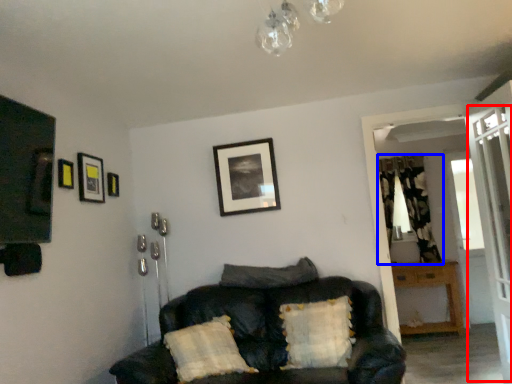
Question: Among these objects, which one is nearest to the camera, screen door (highlighted by a red box) or curtain (highlighted by a blue box)?

Choices:
 (A) screen door
 (B) curtain

Answer: (A)